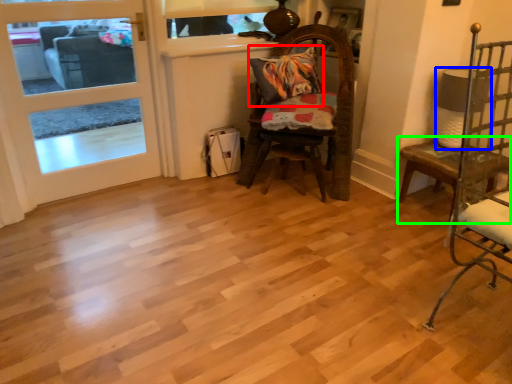
Question: Which object is the farthest from pillow (highlighted by a red box)? Choose among these: lamp (highlighted by a blue box) or table (highlighted by a green box).

Choices:
 (A) lamp
 (B) table

Answer: (B)